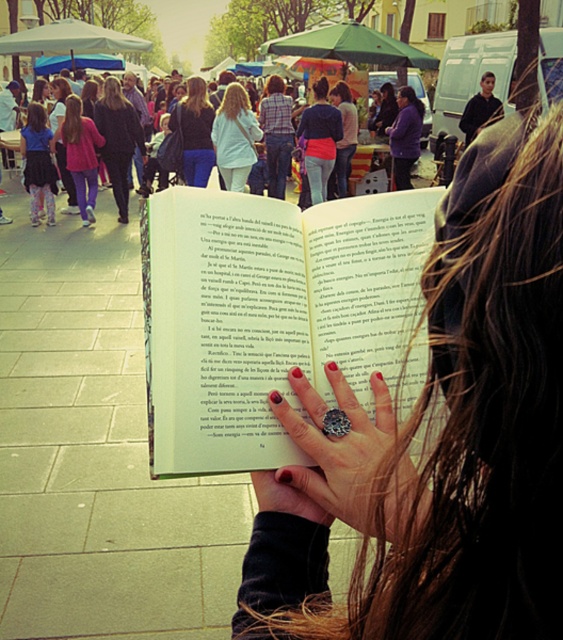
You are organizing a clothing display and need to place the matte black shirt at center and the matte black jacket at center side by side. Given their widths, which one should be placed on the left to ensure they fit within a 1.5 meter wide display area?

The matte black shirt at center is wider than the matte black jacket at center. To fit within the 1.5 meter display area, the wider matte black shirt at center should be placed on the left, followed by the narrower matte black jacket at center on the right.

You are a fashion designer analyzing the clothing items in the scene. Which clothing item has a greater width between the light blue denim jeans at center and the matte black shirt at center?

The light blue denim jeans at center has a greater width than the matte black shirt at center.